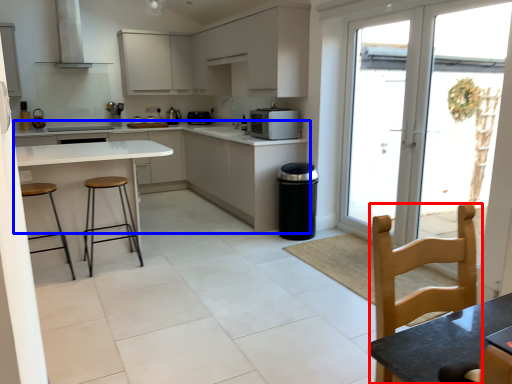
Question: Which object is closer to the camera taking this photo, chair (highlighted by a red box) or cabinetry (highlighted by a blue box)?

Choices:
 (A) chair
 (B) cabinetry

Answer: (A)